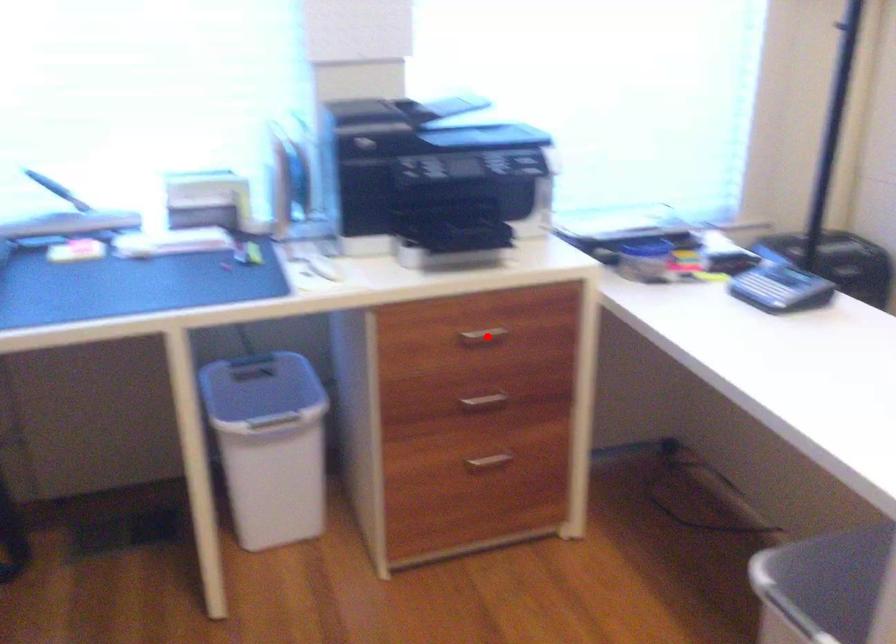
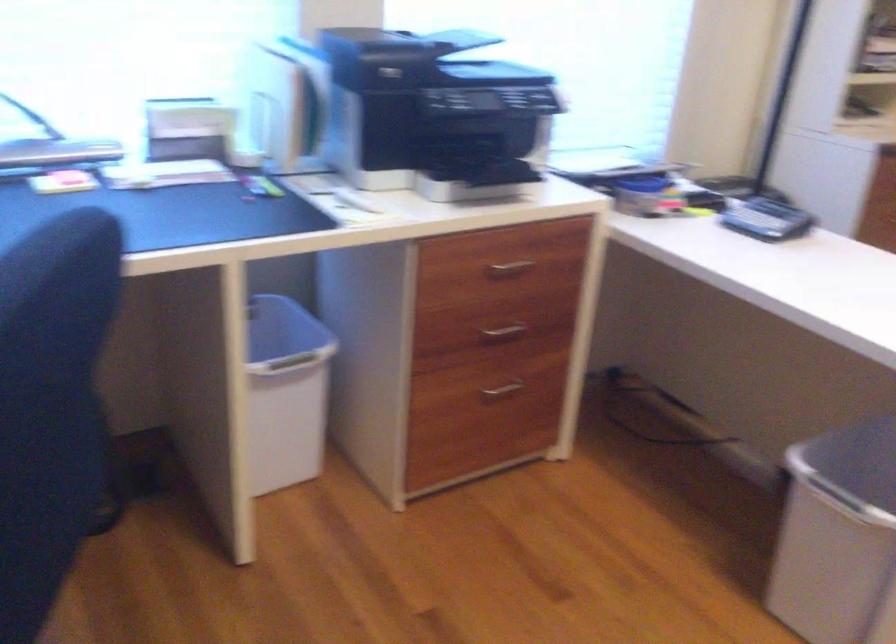
Where in the second image is the point corresponding to the highlighted location from the first image?

(510, 268)